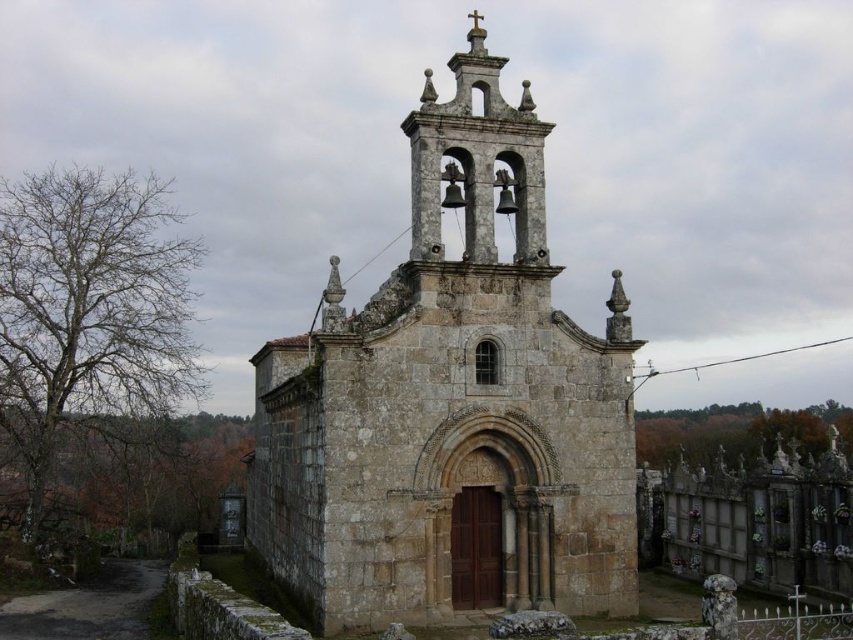
You are standing at the coordinates 0.5, 0.5 in the image. Which direction should you move to reach the rustic stone church at center?

Since the rustic stone church at center is located at point (451, 406), you should move to the right to reach it from your current position at (426, 320).

You are standing at the point marked by coordinates point (x=451, y=406) in the image. Based on the scene description, what structure are you likely standing on or near?

You are standing on or near the rustic stone church at center, as the coordinates point (x=451, y=406) marks this structure in the image.

You are standing in front of the quaint stone church and want to determine which of the two points, point [457,177] or point [468,188], is closer to you. Based on the image, which point is nearer?

Point [457,177] is closer to you because it is further to the viewer than point [468,188].